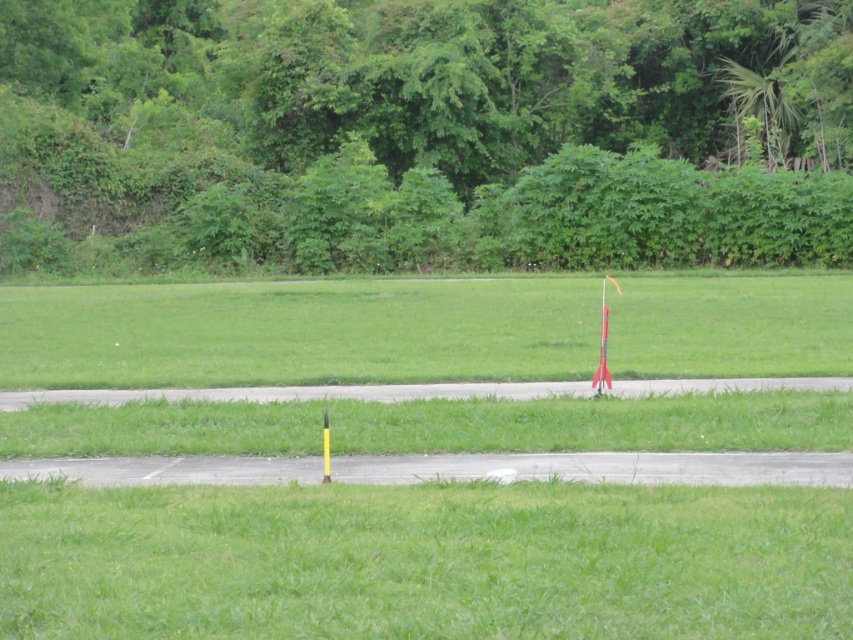
You are standing on the paved area and want to walk towards the green leafy tree at upper center. Which direction should you walk relative to the green grassy at lower center?

You should walk towards the left side of the green grassy at lower center because the green leafy tree at upper center is positioned on the left side of it.

In the scene shown: You are standing at the edge of the grassy field and see the point marked at coordinates (299,332). What is located at that point?

The point at coordinates (299,332) indicates green grass at center.